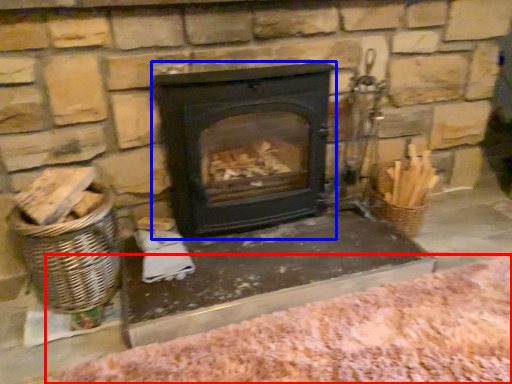
Question: Which object is closer to the camera taking this photo, blanket (highlighted by a red box) or wood burning stove (highlighted by a blue box)?

Choices:
 (A) blanket
 (B) wood burning stove

Answer: (A)